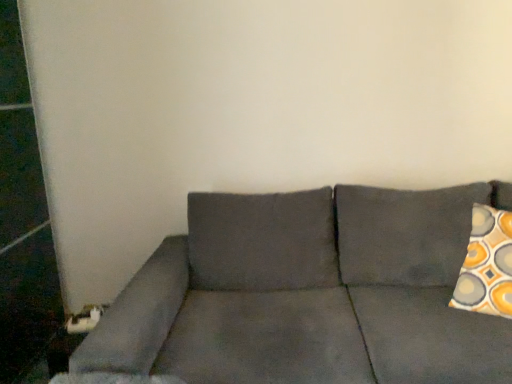
The height and width of the screenshot is (384, 512). In order to click on suede gray couch at center in this screenshot , I will do `click(306, 295)`.

Describe the element at coordinates (306, 295) in the screenshot. I see `suede gray couch at center` at that location.

Image resolution: width=512 pixels, height=384 pixels. I want to click on suede gray couch at center, so click(306, 295).